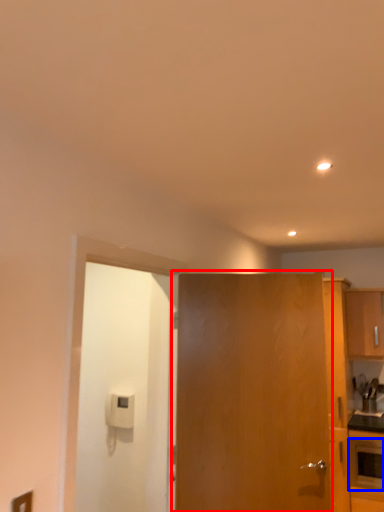
Question: Which object appears farthest to the camera in this image, door (highlighted by a red box) or appliance (highlighted by a blue box)?

Choices:
 (A) door
 (B) appliance

Answer: (B)